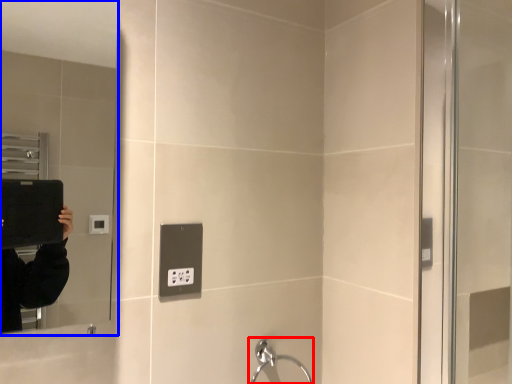
Question: Which of the following is the farthest to the observer, faucet (highlighted by a red box) or mirror (highlighted by a blue box)?

Choices:
 (A) faucet
 (B) mirror

Answer: (A)